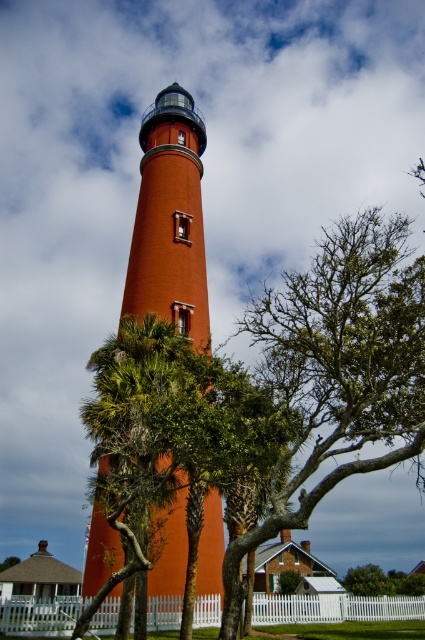
Question: Which of the following is the closest to the observer?

Choices:
 (A) (127, 493)
 (B) (271, 316)
 (C) (197, 124)

Answer: (A)

Question: Does green leafy tree at center have a smaller size compared to green leafy palm tree at center?

Choices:
 (A) no
 (B) yes

Answer: (A)

Question: Which point is closer to the camera?

Choices:
 (A) (198, 586)
 (B) (187, 444)

Answer: (B)

Question: Does green leafy tree at center appear under smooth orange lighthouse at center?

Choices:
 (A) no
 (B) yes

Answer: (B)

Question: Which object appears farthest from the camera in this image?

Choices:
 (A) smooth orange lighthouse at center
 (B) green leafy tree at center
 (C) green leafy palm tree at center

Answer: (A)

Question: Does green leafy palm tree at center come in front of smooth orange lighthouse at center?

Choices:
 (A) no
 (B) yes

Answer: (B)